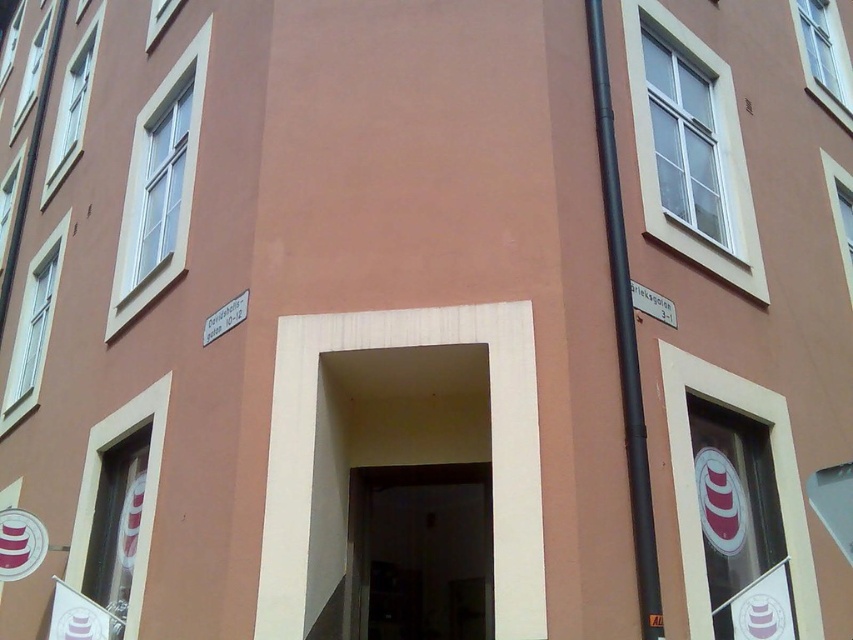
Is dark wood door at center positioned before white plastic street sign at upper right?

Yes, it is.

Does dark wood door at center appear on the left side of white plastic street sign at upper right?

Indeed, dark wood door at center is positioned on the left side of white plastic street sign at upper right.

Between point (376, 630) and point (654, 317), which one is positioned in front?

Positioned in front is point (654, 317).

Where is `dark wood door at center`? dark wood door at center is located at coordinates (419, 554).

Between point (368, 605) and point (633, 522), which one is positioned in front?

Positioned in front is point (633, 522).

Does dark wood door at center appear on the right side of black matte pipe at right?

In fact, dark wood door at center is to the left of black matte pipe at right.

Who is more forward, (386, 588) or (650, 548)?

Point (650, 548)

The image size is (853, 640). I want to click on dark wood door at center, so click(x=419, y=554).

Can you confirm if black matte pipe at right is smaller than white plastic street sign at upper right?

No, black matte pipe at right is not smaller than white plastic street sign at upper right.

Is point (637, 493) positioned before point (631, 288)?

That is True.

Is point (646, 538) behind point (650, 314)?

No, it is in front of (650, 314).

Find the location of a particular element. This screenshot has width=853, height=640. black matte pipe at right is located at coordinates (624, 333).